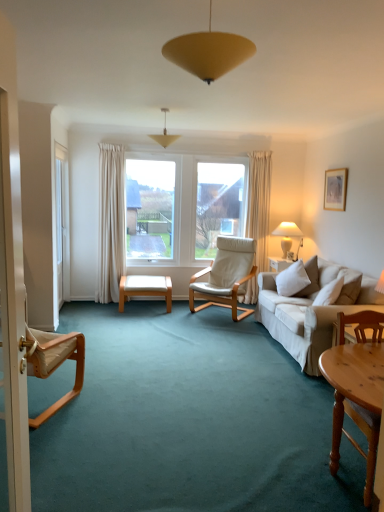
Question: Would you say beige fabric chair at left, the 2th chair when ordered from front to back, is part of matte yellow cone at center, which appears as the 1th lamp when viewed from the left,'s contents?

Choices:
 (A) yes
 (B) no

Answer: (B)

Question: From the image's perspective, does matte yellow cone at center, marked as the third lamp in a bottom-to-top arrangement, appear lower than beige fabric chair at left, the 2th chair when ordered from front to back?

Choices:
 (A) yes
 (B) no

Answer: (B)

Question: Can you confirm if matte yellow cone at center, the 2th lamp in the back-to-front sequence, is wider than beige fabric chair at left, the third chair in the right-to-left sequence?

Choices:
 (A) no
 (B) yes

Answer: (A)

Question: Is matte yellow cone at center, which appears as the 1th lamp when viewed from the left, in front of beige fabric chair at left, the third chair in the right-to-left sequence?

Choices:
 (A) no
 (B) yes

Answer: (A)

Question: Is matte yellow cone at center, the 2th lamp in the back-to-front sequence, bigger than beige fabric chair at left, which is the 2th chair from back to front?

Choices:
 (A) no
 (B) yes

Answer: (A)

Question: Is wooden chair at lower right, the 3th chair when ordered from back to front, situated inside white ceramic lamp at right, placed as the 3th lamp when sorted from left to right, or outside?

Choices:
 (A) outside
 (B) inside

Answer: (A)

Question: Is point (357, 313) positioned closer to the camera than point (289, 242)?

Choices:
 (A) closer
 (B) farther

Answer: (A)

Question: Considering their positions, is wooden chair at lower right, the third chair when ordered from left to right, located in front of or behind white ceramic lamp at right, which ranks as the first lamp in back-to-front order?

Choices:
 (A) front
 (B) behind

Answer: (A)

Question: From the image's perspective, relative to white ceramic lamp at right, the third lamp viewed from the front, is wooden chair at lower right, the 3th chair when ordered from back to front, above or below?

Choices:
 (A) below
 (B) above

Answer: (A)

Question: Based on their positions, is white ceramic lamp at right, which ranks as the first lamp in back-to-front order, located to the left or right of wooden chair at lower right, the 3th chair when ordered from back to front?

Choices:
 (A) left
 (B) right

Answer: (B)

Question: Relative to wooden chair at lower right, which is counted as the 1th chair, starting from the front, is white ceramic lamp at right, which ranks as the first lamp in back-to-front order, in front or behind?

Choices:
 (A) behind
 (B) front

Answer: (A)

Question: From a real-world perspective, is white ceramic lamp at right, the first lamp ordered from the bottom, physically located above or below wooden chair at lower right, which is counted as the 1th chair, starting from the front?

Choices:
 (A) below
 (B) above

Answer: (B)

Question: Considering the positions of point (284, 247) and point (372, 432), is point (284, 247) closer or farther from the camera than point (372, 432)?

Choices:
 (A) farther
 (B) closer

Answer: (A)

Question: In terms of height, does light wood bench at center look taller or shorter compared to white leather chair at center, the 3th chair in the front-to-back sequence?

Choices:
 (A) short
 (B) tall

Answer: (A)

Question: Based on their positions, is light wood bench at center located to the left or right of white leather chair at center, which is the 2th chair from right to left?

Choices:
 (A) left
 (B) right

Answer: (A)